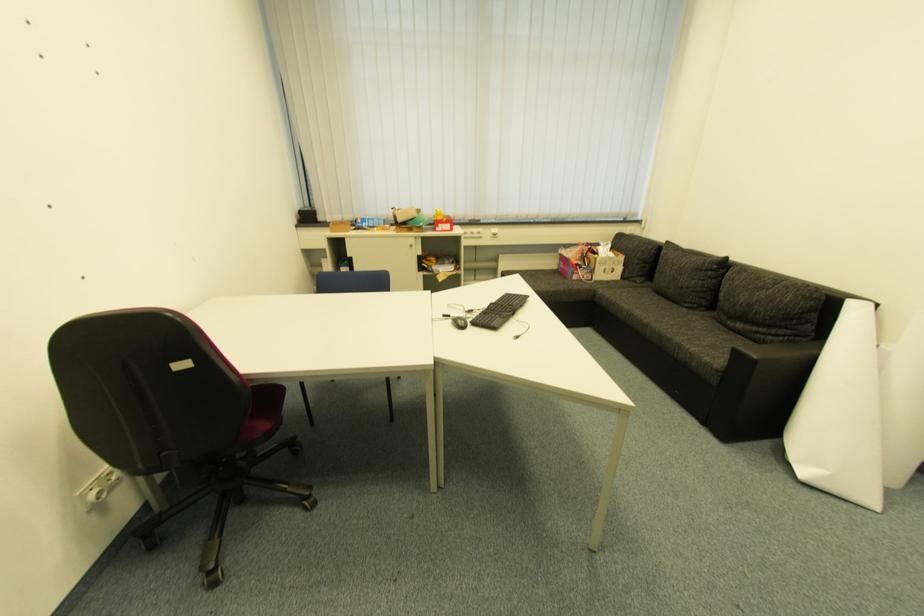
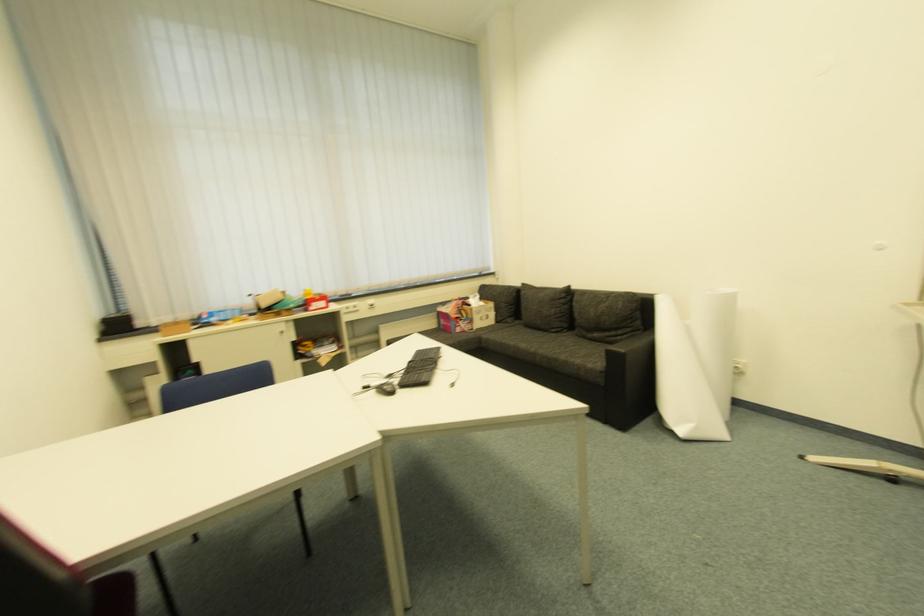
Which direction would the cameraman need to move to produce the second image?

The movement direction of the cameraman is left, forward.